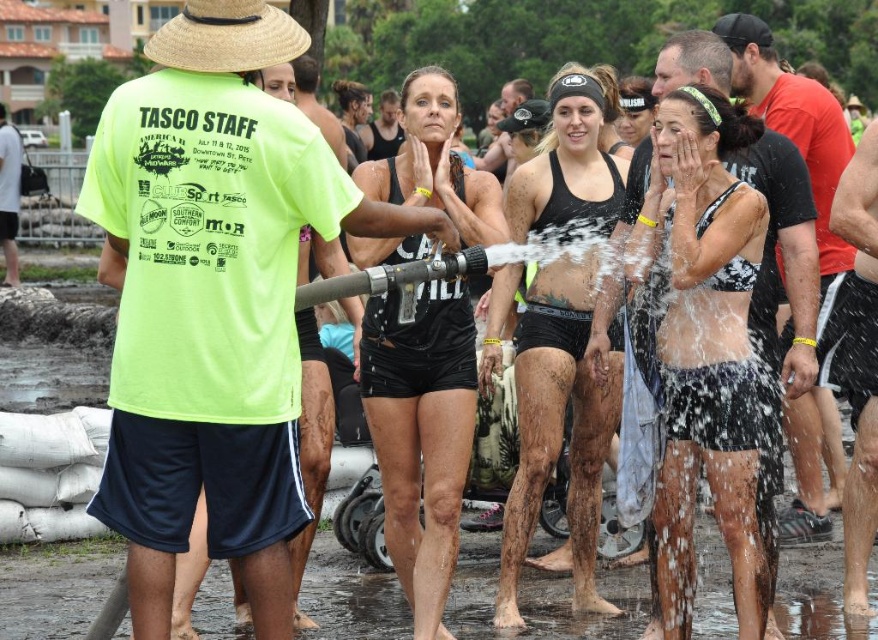
This screenshot has height=640, width=878. What are the coordinates of `black matte swimsuit at center` in the screenshot? It's located at (551, 419).

Is black matte swimsuit at center positioned at the back of black athletic shorts at center?

That is True.

Is point (587, 83) positioned in front of point (660, 70)?

Yes, it is in front of point (660, 70).

The width and height of the screenshot is (878, 640). I want to click on black matte swimsuit at center, so click(551, 419).

The height and width of the screenshot is (640, 878). Describe the element at coordinates (214, 300) in the screenshot. I see `neon yellow t-shirt at center` at that location.

Is neon yellow t-shirt at center to the left of matte black tank top at center from the viewer's perspective?

Indeed, neon yellow t-shirt at center is positioned on the left side of matte black tank top at center.

Is point (142, 99) positioned in front of point (810, 125)?

Yes, point (142, 99) is closer to viewer.

The width and height of the screenshot is (878, 640). What are the coordinates of `neon yellow t-shirt at center` in the screenshot? It's located at (214, 300).

Is matte black tank top at center thinner than straw hat at upper left?

Yes, matte black tank top at center is thinner than straw hat at upper left.

Between point (749, 60) and point (248, 20), which one is positioned in front?

Point (248, 20)

You are a GUI agent. You are given a task and a screenshot of the screen. Output one action in this format:
    pyautogui.click(x=<x>, y=<y>)
    Task: Click on the matte black tank top at center
    This screenshot has height=640, width=878.
    Given the screenshot: What is the action you would take?
    pyautogui.click(x=793, y=124)